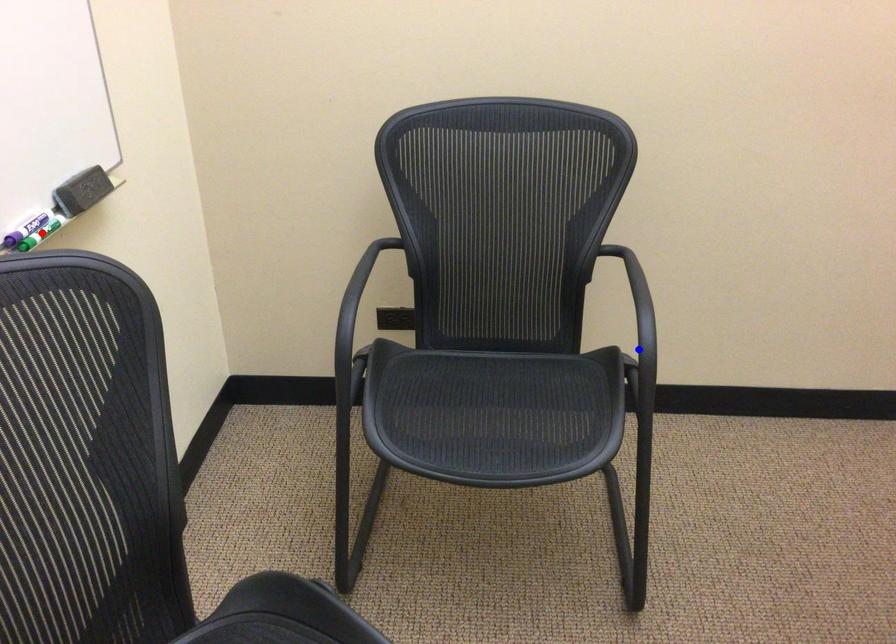
Question: Two points are marked on the image. Which point is closer to the camera?

Choices:
 (A) Blue point is closer.
 (B) Red point is closer.

Answer: (B)